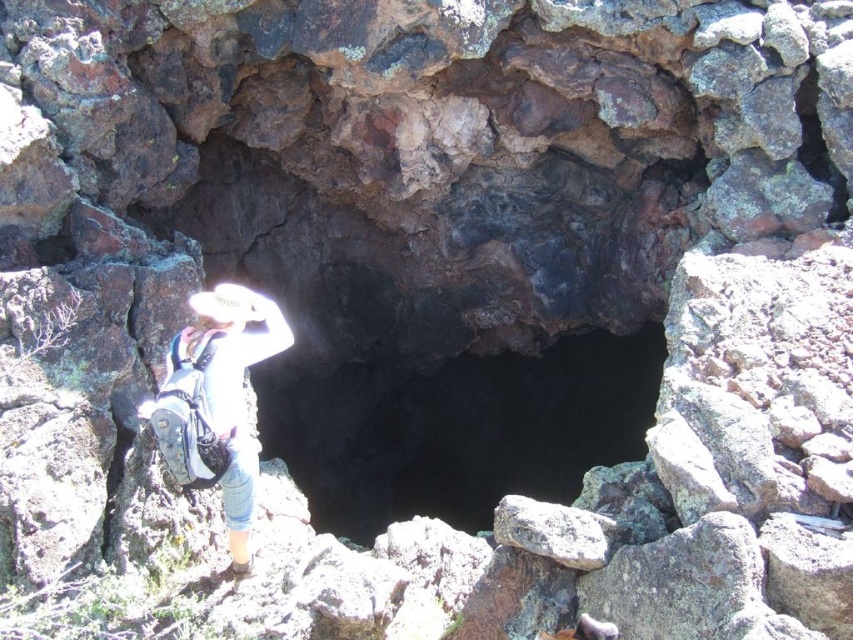
Is black rock hole at center positioned before white fabric hat at upper center?

That is False.

How far apart are black rock hole at center and white fabric hat at upper center?

black rock hole at center is 35.63 feet from white fabric hat at upper center.

Does point (421, 378) lie behind point (169, 369)?

Yes, it is.

At what (x,y) coordinates should I click in order to perform the action: click on black rock hole at center. Please return your answer as a coordinate pair (x, y). The width and height of the screenshot is (853, 640). Looking at the image, I should click on (460, 428).